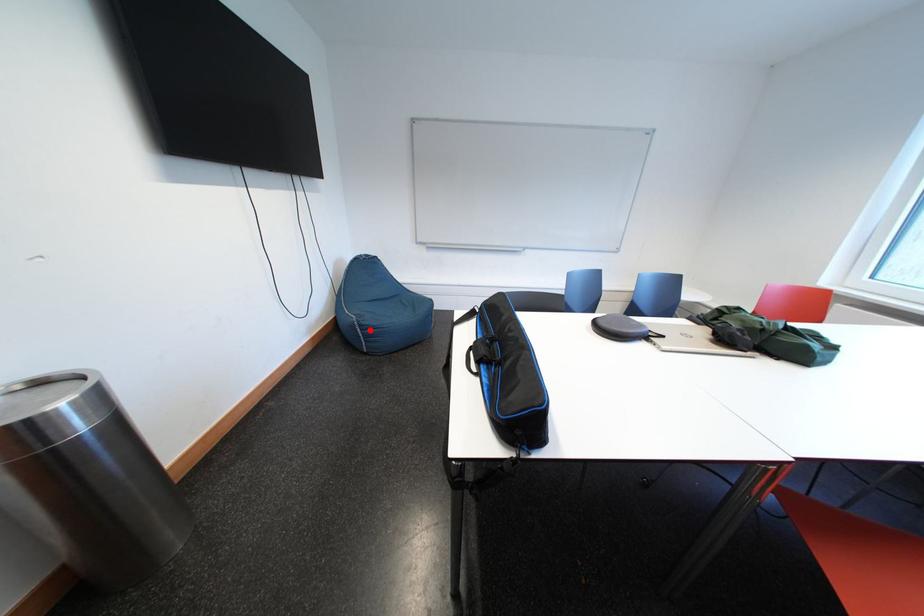
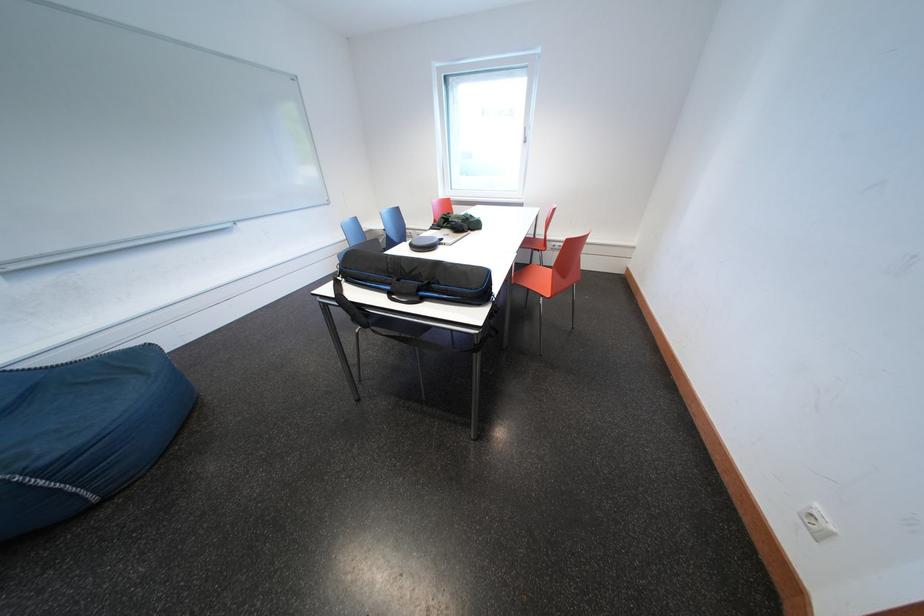
Where in the second image is the point corresponding to the highlighted location from the first image?

(46, 477)